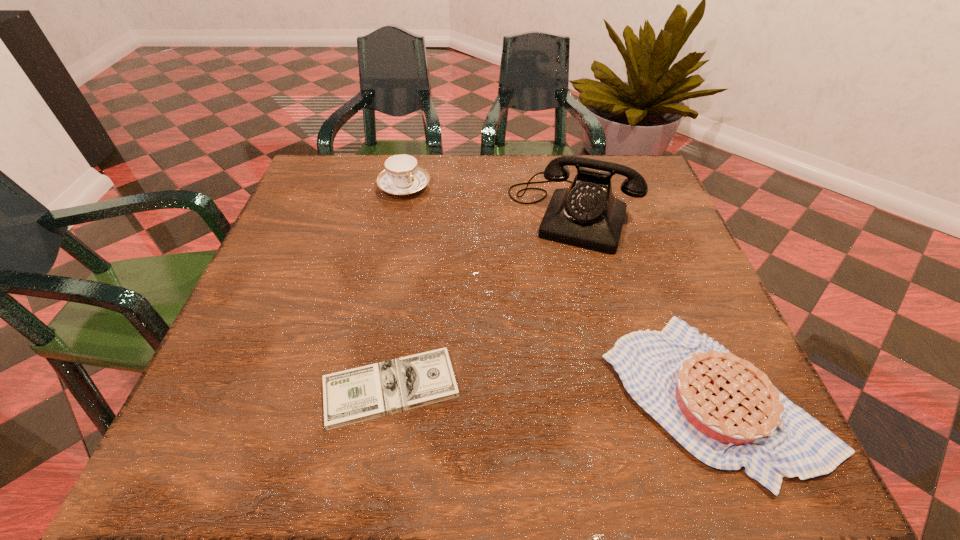
Where is `free space at the far edge of the desktop`? This screenshot has width=960, height=540. free space at the far edge of the desktop is located at coordinates (483, 198).

Locate an element on the screen. free space at the near edge is located at coordinates (383, 362).

Locate an element on the screen. The image size is (960, 540). vacant area at the left edge is located at coordinates (278, 271).

This screenshot has width=960, height=540. What are the coordinates of `vacant space at the right edge of the desktop` in the screenshot? It's located at (631, 213).

Where is `free space at the near left corner of the desktop`? The width and height of the screenshot is (960, 540). free space at the near left corner of the desktop is located at coordinates (241, 401).

At what (x,y) coordinates should I click in order to perform the action: click on vacant position at the far right corner of the desktop. Please return your answer as a coordinate pair (x, y). Looking at the image, I should click on (650, 198).

Locate an element on the screen. Image resolution: width=960 pixels, height=540 pixels. free space between the pie and the telephone is located at coordinates (643, 305).

This screenshot has width=960, height=540. What are the coordinates of `vacant area between the dollar and the pie` in the screenshot? It's located at (552, 392).

The image size is (960, 540). I want to click on free space between the tallest object and the teacup, so click(x=489, y=200).

Find the location of a particular element. free point between the tallest object and the second shortest object is located at coordinates (643, 305).